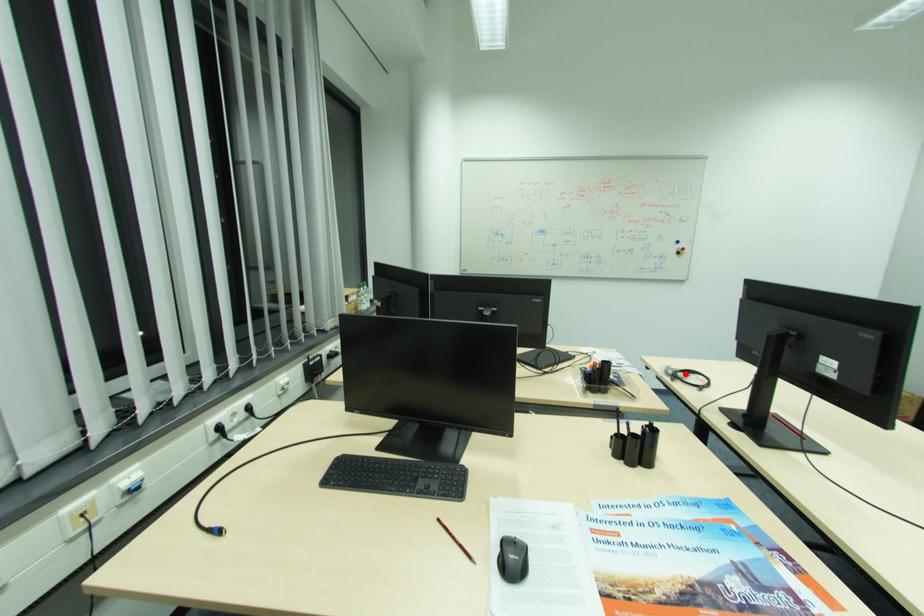
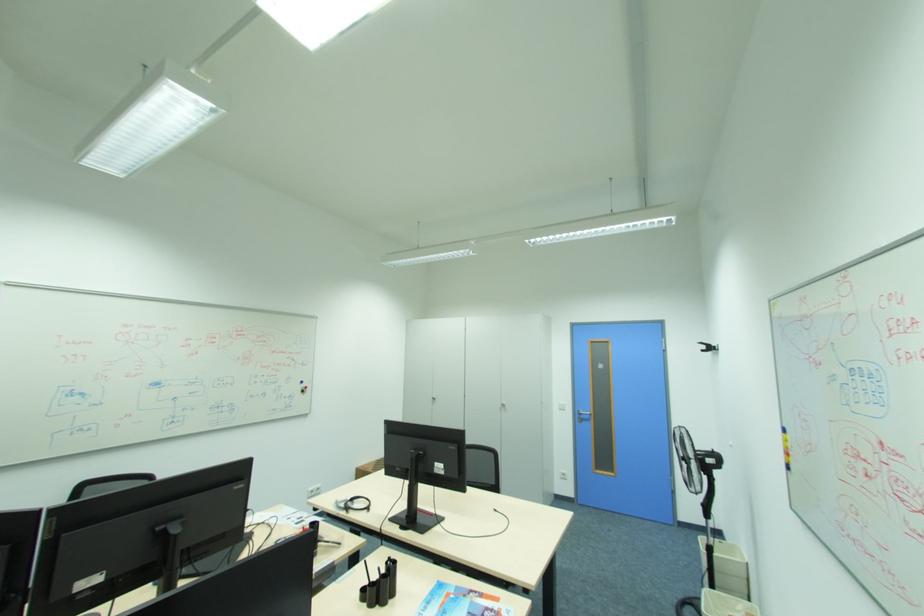
Find the pixel in the second image that matches the highlighted location in the first image.

(355, 505)